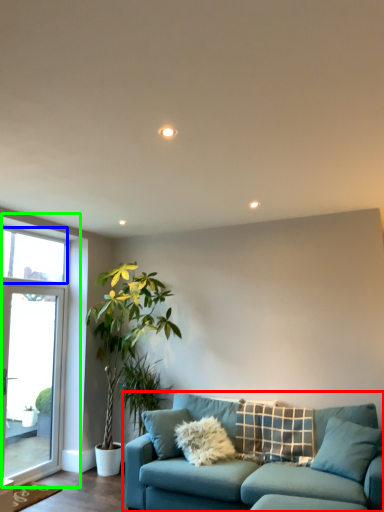
Question: Which is farther away from studio couch (highlighted by a red box)? window screen (highlighted by a blue box) or window (highlighted by a green box)?

Choices:
 (A) window screen
 (B) window

Answer: (A)